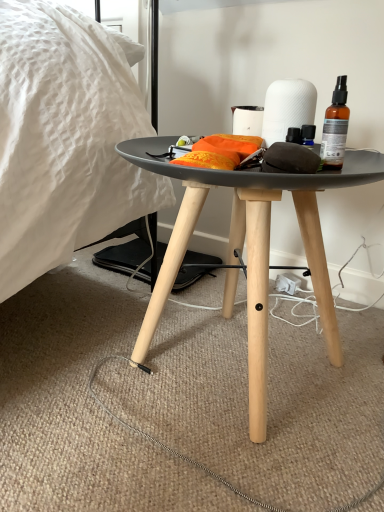
Question: Does orange fabric at center have a larger size compared to translucent amber glass spray bottle at upper right?

Choices:
 (A) yes
 (B) no

Answer: (A)

Question: Is orange fabric at center next to translucent amber glass spray bottle at upper right?

Choices:
 (A) no
 (B) yes

Answer: (A)

Question: Is orange fabric at center closer to camera compared to translucent amber glass spray bottle at upper right?

Choices:
 (A) no
 (B) yes

Answer: (B)

Question: Considering the relative sizes of orange fabric at center and translucent amber glass spray bottle at upper right in the image provided, is orange fabric at center wider than translucent amber glass spray bottle at upper right?

Choices:
 (A) yes
 (B) no

Answer: (A)

Question: Is orange fabric at center positioned beyond the bounds of translucent amber glass spray bottle at upper right?

Choices:
 (A) no
 (B) yes

Answer: (B)

Question: Would you say orange fabric at center contains translucent amber glass spray bottle at upper right?

Choices:
 (A) yes
 (B) no

Answer: (B)

Question: Can white matte paper towel at center be found inside orange fabric at center?

Choices:
 (A) yes
 (B) no

Answer: (B)

Question: Is orange fabric at center facing towards white matte paper towel at center?

Choices:
 (A) no
 (B) yes

Answer: (A)

Question: Is there a large distance between orange fabric at center and white matte paper towel at center?

Choices:
 (A) yes
 (B) no

Answer: (B)

Question: From a real-world perspective, is orange fabric at center on white matte paper towel at center?

Choices:
 (A) yes
 (B) no

Answer: (B)

Question: Can you confirm if orange fabric at center is positioned to the left of white matte paper towel at center?

Choices:
 (A) no
 (B) yes

Answer: (B)

Question: Is orange fabric at center placed right next to white matte paper towel at center?

Choices:
 (A) no
 (B) yes

Answer: (A)

Question: Does white matte paper towel at center lie behind orange fabric at center?

Choices:
 (A) yes
 (B) no

Answer: (A)